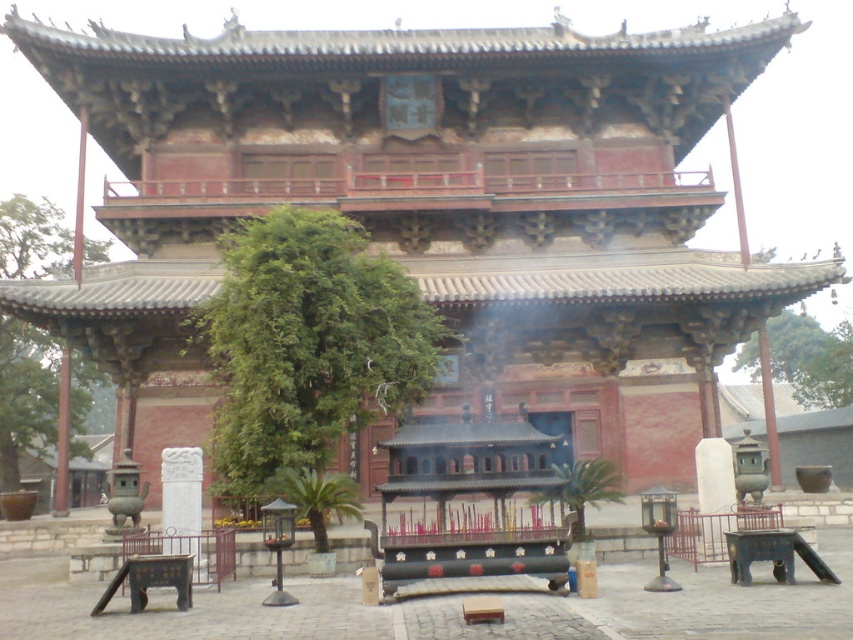
Between point (351, 429) and point (780, 336), which one is positioned behind?

Positioned behind is point (780, 336).

Is point (219, 352) behind point (844, 388)?

No, it is not.

Identify the location of green leafy tree at center. This screenshot has height=640, width=853. (306, 342).

Which of these two, green leafy tree at left or green leafy tree at upper right, stands taller?

green leafy tree at left is taller.

Does point (86, 404) come farther from viewer compared to point (842, 404)?

That is False.

Where is `green leafy tree at left`? green leafy tree at left is located at coordinates (25, 394).

Which is more to the right, green leafy tree at center or green leafy tree at left?

Positioned to the right is green leafy tree at center.

Who is more distant from viewer, (248, 296) or (27, 342)?

Positioned behind is point (27, 342).

This screenshot has width=853, height=640. I want to click on green leafy tree at center, so click(306, 342).

You are a GUI agent. You are given a task and a screenshot of the screen. Output one action in this format:
    pyautogui.click(x=<x>, y=<y>)
    Task: Click on the green leafy tree at center
    The width and height of the screenshot is (853, 640).
    Given the screenshot: What is the action you would take?
    pyautogui.click(x=306, y=342)